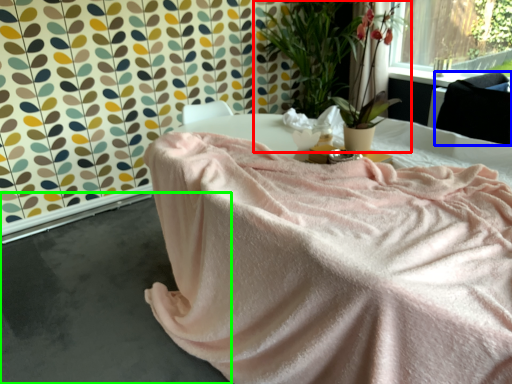
Question: Based on their relative distances, which object is farther from houseplant (highlighted by a red box)? Choose from satin (highlighted by a blue box) and concrete (highlighted by a green box).

Choices:
 (A) satin
 (B) concrete

Answer: (B)